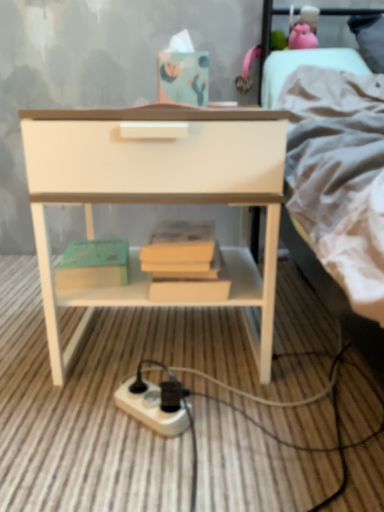
Question: Does green matte paperback book at lower left have a greater height compared to white glossy nightstand at center?

Choices:
 (A) no
 (B) yes

Answer: (A)

Question: Could you tell me if green matte paperback book at lower left is facing white glossy nightstand at center?

Choices:
 (A) no
 (B) yes

Answer: (B)

Question: From the image's perspective, would you say green matte paperback book at lower left is shown under white glossy nightstand at center?

Choices:
 (A) yes
 (B) no

Answer: (A)

Question: Considering the relative sizes of green matte paperback book at lower left and white glossy nightstand at center in the image provided, is green matte paperback book at lower left bigger than white glossy nightstand at center?

Choices:
 (A) no
 (B) yes

Answer: (A)

Question: Is green matte paperback book at lower left wider than white glossy nightstand at center?

Choices:
 (A) no
 (B) yes

Answer: (A)

Question: From the image's perspective, is white glossy nightstand at center positioned above or below light gray fabric bed at upper right?

Choices:
 (A) below
 (B) above

Answer: (A)

Question: Based on their sizes in the image, would you say white glossy nightstand at center is bigger or smaller than light gray fabric bed at upper right?

Choices:
 (A) big
 (B) small

Answer: (B)

Question: In the image, is white glossy nightstand at center positioned in front of or behind light gray fabric bed at upper right?

Choices:
 (A) behind
 (B) front

Answer: (B)

Question: Looking at their shapes, would you say white glossy nightstand at center is wider or thinner than light gray fabric bed at upper right?

Choices:
 (A) thin
 (B) wide

Answer: (A)

Question: Is white glossy nightstand at center taller or shorter than green matte paperback book at lower left?

Choices:
 (A) tall
 (B) short

Answer: (A)

Question: Looking at the image, does white glossy nightstand at center seem bigger or smaller compared to green matte paperback book at lower left?

Choices:
 (A) small
 (B) big

Answer: (B)

Question: From a real-world perspective, is white glossy nightstand at center above or below green matte paperback book at lower left?

Choices:
 (A) above
 (B) below

Answer: (A)

Question: Is point (112, 186) closer or farther from the camera than point (64, 266)?

Choices:
 (A) closer
 (B) farther

Answer: (A)

Question: Looking at the image, does white plastic power plugs and sockets at lower center seem bigger or smaller compared to light gray fabric bed at upper right?

Choices:
 (A) small
 (B) big

Answer: (A)

Question: Is white plastic power plugs and sockets at lower center spatially inside light gray fabric bed at upper right, or outside of it?

Choices:
 (A) outside
 (B) inside

Answer: (A)